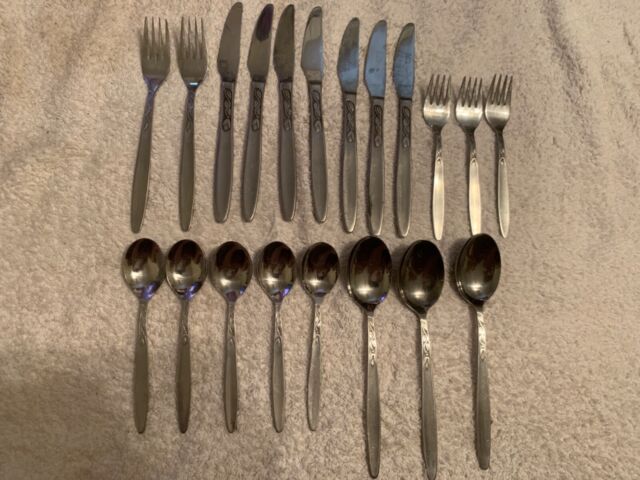
You are a GUI agent. You are given a task and a screenshot of the screen. Output one action in this format:
    pyautogui.click(x=<x>, y=<y>)
    Task: Click on the spoons
    This screenshot has height=480, width=640.
    Given the screenshot: What is the action you would take?
    pyautogui.click(x=148, y=273), pyautogui.click(x=182, y=273), pyautogui.click(x=235, y=268), pyautogui.click(x=276, y=270), pyautogui.click(x=317, y=277), pyautogui.click(x=361, y=275), pyautogui.click(x=413, y=278), pyautogui.click(x=477, y=274)